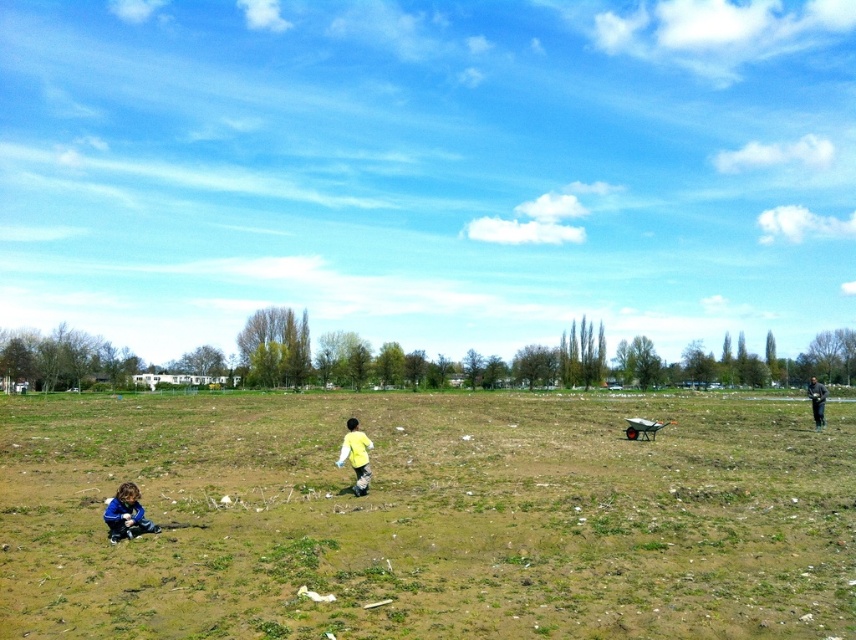
Question: Where is yellow matte shirt at center located in relation to dark gray fabric at right in the image?

Choices:
 (A) above
 (B) below

Answer: (A)

Question: In this image, where is yellow matte shirt at center located relative to dark gray fabric at right?

Choices:
 (A) right
 (B) left

Answer: (B)

Question: Does green grass at center appear under dark gray fabric at right?

Choices:
 (A) yes
 (B) no

Answer: (B)

Question: Among these objects, which one is farthest from the camera?

Choices:
 (A) green grass at center
 (B) blue fleece jacket at lower left

Answer: (B)

Question: Which point is closer to the camera?

Choices:
 (A) (681, 417)
 (B) (122, 532)

Answer: (B)

Question: Which point is farther to the camera?

Choices:
 (A) yellow matte shirt at center
 (B) blue fleece jacket at lower left
 (C) dark gray fabric at right
 (D) green grass at center

Answer: (C)